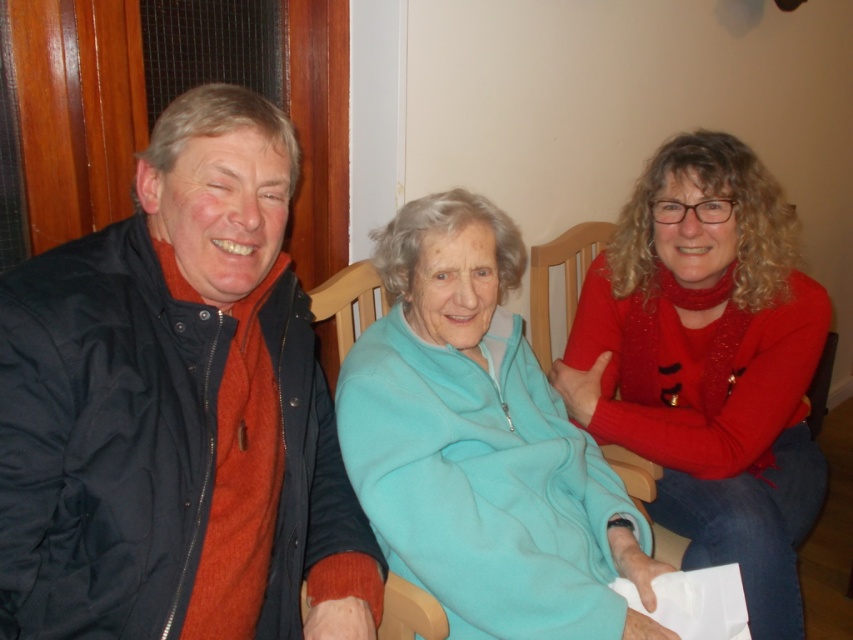
Question: Can you confirm if matte black jacket at left is positioned below matte red sweater at right?

Choices:
 (A) no
 (B) yes

Answer: (A)

Question: Which is nearer to the teal fleece blanket at center?

Choices:
 (A) wooden chair at center
 (B) matte black jacket at left

Answer: (B)

Question: Can you confirm if matte red sweater at right is thinner than wooden chair at center?

Choices:
 (A) yes
 (B) no

Answer: (B)

Question: Which point is farther from the camera taking this photo?

Choices:
 (A) pyautogui.click(x=445, y=340)
 (B) pyautogui.click(x=402, y=632)
 (C) pyautogui.click(x=138, y=406)

Answer: (A)

Question: Does teal fleece blanket at center have a greater width compared to matte red sweater at right?

Choices:
 (A) yes
 (B) no

Answer: (B)

Question: Which of the following is the closest to the observer?

Choices:
 (A) click(x=479, y=196)
 (B) click(x=735, y=381)
 (C) click(x=68, y=506)
 (D) click(x=334, y=342)

Answer: (C)